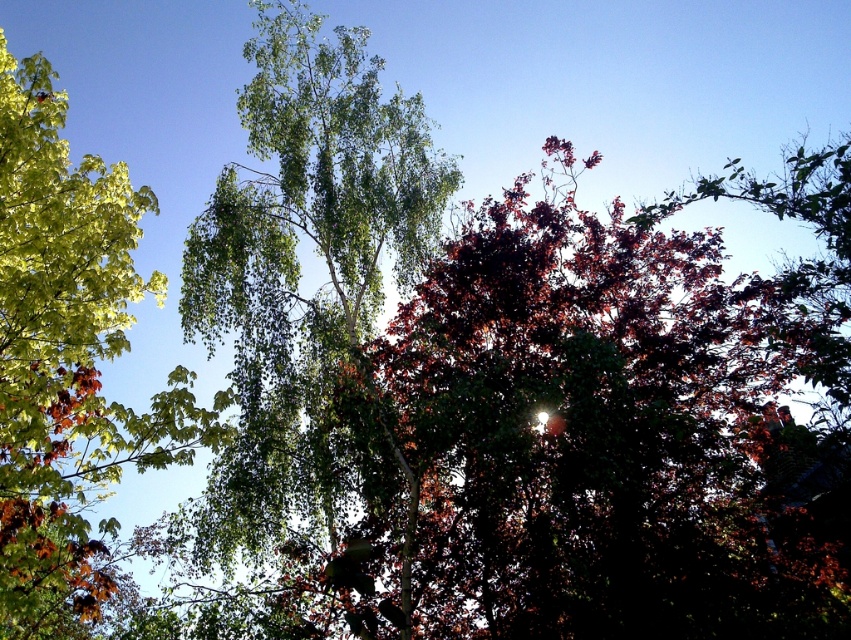
Where is `green leafy birch tree at center`? Image resolution: width=851 pixels, height=640 pixels. green leafy birch tree at center is located at coordinates 313,300.

Which of these two, green leafy birch tree at center or green leafy tree at left, stands taller?

green leafy birch tree at center is taller.

Measure the distance between point (212, 200) and camera.

The distance of point (212, 200) from camera is 14.78 meters.

The height and width of the screenshot is (640, 851). Find the location of `green leafy birch tree at center`. green leafy birch tree at center is located at coordinates (313, 300).